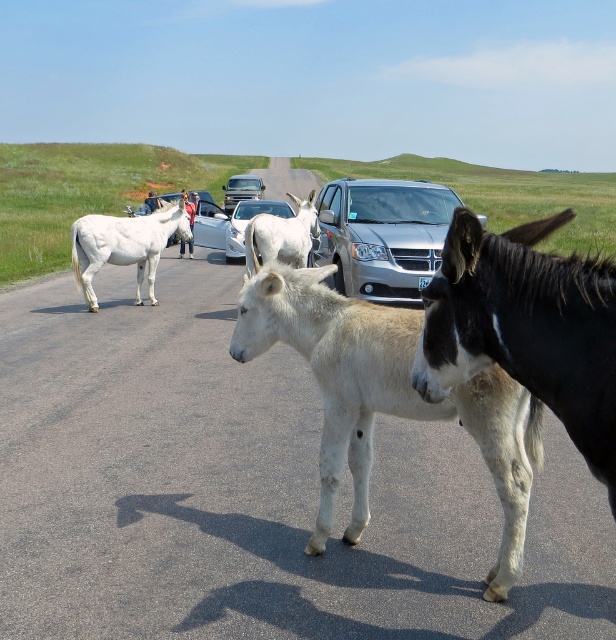
Looking at this image, between metallic silver sedan at center and metallic silver van at center, which one has less height?

metallic silver sedan at center is shorter.

Is point (229, 253) more distant than point (253, 173)?

No, it is in front of (253, 173).

Where is `metallic silver sedan at center`? metallic silver sedan at center is located at coordinates (233, 225).

Does point (444, 221) lie in front of point (261, 186)?

That is True.

Can you confirm if silver metallic van at center is positioned to the left of metallic silver van at center?

No, silver metallic van at center is not to the left of metallic silver van at center.

Which is in front, point (455, 202) or point (240, 189)?

Point (455, 202) is in front.

In order to click on silver metallic van at center in this screenshot , I will do `click(383, 234)`.

Which is below, white matte horse at left or silver metallic sedan at center?

white matte horse at left is lower down.

Is white matte horse at left above silver metallic sedan at center?

No.

Who is more distant from viewer, (116, 240) or (206, 205)?

Point (206, 205)

I want to click on white matte horse at left, so click(x=123, y=244).